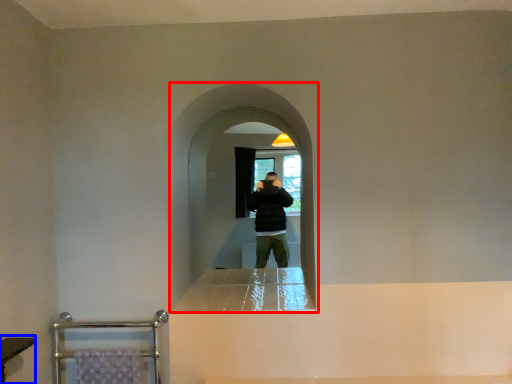
Question: Which of the following is the farthest to the observer, screen door (highlighted by a red box) or vanity (highlighted by a blue box)?

Choices:
 (A) screen door
 (B) vanity

Answer: (A)